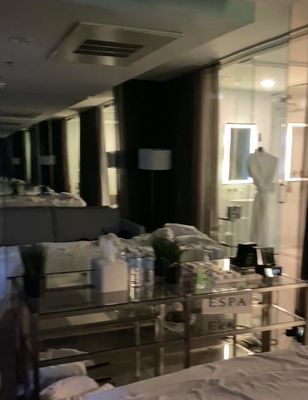
Where is `facial tissue`? This screenshot has width=308, height=400. facial tissue is located at coordinates (109, 255).